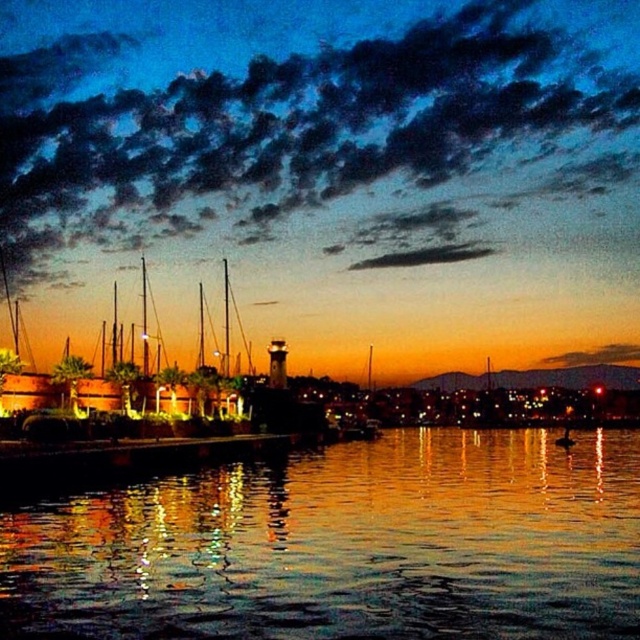
Who is higher up, reflective glass water at center or wooden dock at left?

wooden dock at left is higher up.

Which is more to the left, reflective glass water at center or wooden dock at left?

From the viewer's perspective, wooden dock at left appears more on the left side.

This screenshot has height=640, width=640. Identify the location of reflective glass water at center. (346, 545).